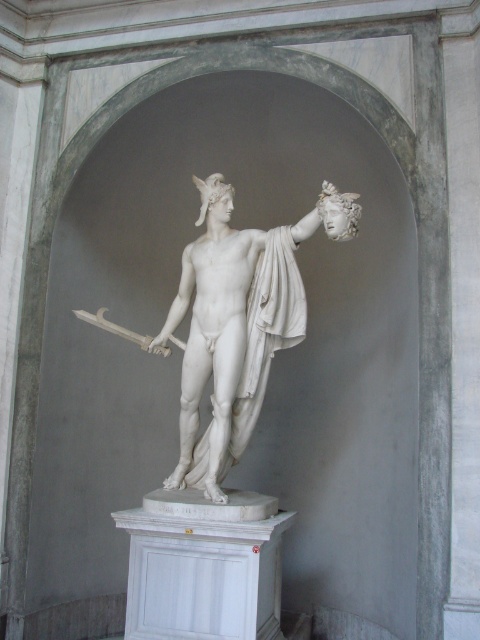
Question: Can you confirm if white marble statue at center is bigger than polished silver sword at center?

Choices:
 (A) yes
 (B) no

Answer: (A)

Question: Which point is closer to the camera?

Choices:
 (A) (214, 432)
 (B) (160, 353)

Answer: (A)

Question: Which object appears closest to the camera in this image?

Choices:
 (A) white marble statue at center
 (B) polished silver sword at center

Answer: (A)

Question: In this image, where is white marble statue at center located relative to polished silver sword at center?

Choices:
 (A) left
 (B) right

Answer: (B)

Question: Does white marble statue at center have a greater width compared to polished silver sword at center?

Choices:
 (A) yes
 (B) no

Answer: (A)

Question: Which point is farther to the camera?

Choices:
 (A) polished silver sword at center
 (B) white marble statue at center

Answer: (A)